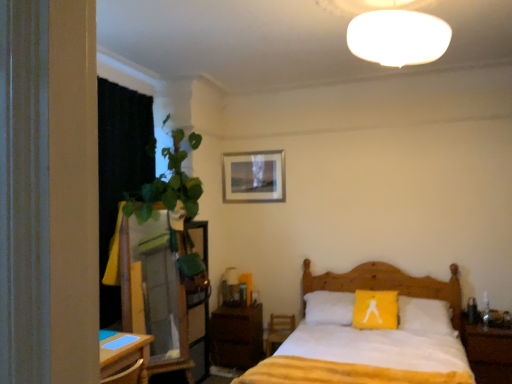
Measure the distance between white soft bedsheet at lower center and camera.

They are 2.55 meters apart.

Find the location of a particular element. The width and height of the screenshot is (512, 384). white soft bedsheet at lower center is located at coordinates (367, 357).

The width and height of the screenshot is (512, 384). In order to click on dark brown wood nightstand at lower center, the 2th nightstand viewed from the front in this screenshot , I will do 236,336.

Find the location of a particular element. The image size is (512, 384). white soft bed at center is located at coordinates (362, 358).

Find the location of a particular element. This screenshot has width=512, height=384. black fabric curtain at left is located at coordinates (120, 169).

Where is `white soft bedsheet at lower center`? white soft bedsheet at lower center is located at coordinates (367, 357).

Can wooden nightstand at right, which appears as the 2th nightstand when viewed from the left, be found inside white soft bed at center?

No, wooden nightstand at right, which appears as the 2th nightstand when viewed from the left, is located outside of white soft bed at center.

Is white soft bed at center aimed at wooden nightstand at right, arranged as the 1th nightstand when viewed from the front?

No, white soft bed at center does not turn towards wooden nightstand at right, arranged as the 1th nightstand when viewed from the front.

Does white soft bed at center have a smaller size compared to wooden nightstand at right, positioned as the 1th nightstand in right-to-left order?

No, white soft bed at center is not smaller than wooden nightstand at right, positioned as the 1th nightstand in right-to-left order.

From the image's perspective, would you say white soft bed at center is positioned over wooden nightstand at right, which appears as the 2th nightstand when viewed from the left?

Correct, white soft bed at center appears higher than wooden nightstand at right, which appears as the 2th nightstand when viewed from the left, in the image.

Is white soft bedsheet at lower center bigger or smaller than matte glass table lamp at center?

In the image, white soft bedsheet at lower center appears to be larger than matte glass table lamp at center.

Is white soft bedsheet at lower center aimed at matte glass table lamp at center?

No, white soft bedsheet at lower center is not oriented towards matte glass table lamp at center.

Is white soft bedsheet at lower center wider or thinner than matte glass table lamp at center?

white soft bedsheet at lower center is wider than matte glass table lamp at center.

From the image's perspective, which object appears higher, white soft bedsheet at lower center or matte glass table lamp at center?

matte glass table lamp at center appears higher in the image.

From a real-world perspective, is matte glass table lamp at center physically located above or below gold-framed picture at upper center?

In terms of real-world spatial position, matte glass table lamp at center is below gold-framed picture at upper center.

Which of these two, matte glass table lamp at center or gold-framed picture at upper center, is bigger?

matte glass table lamp at center is bigger.

Looking at this image, from the image's perspective, is matte glass table lamp at center on top of gold-framed picture at upper center?

No, from the image's perspective, matte glass table lamp at center is not over gold-framed picture at upper center.

Is white soft bedsheet at lower center completely or partially outside of dark brown wood nightstand at lower center, the 2th nightstand viewed from the front?

Yes, white soft bedsheet at lower center is outside of dark brown wood nightstand at lower center, the 2th nightstand viewed from the front.

In the scene shown: From the image's perspective, between white soft bedsheet at lower center and dark brown wood nightstand at lower center, which is the 1th nightstand from back to front, which one is located above?

white soft bedsheet at lower center appears higher in the image.

Considering the sizes of objects white soft bedsheet at lower center and dark brown wood nightstand at lower center, which is counted as the 1th nightstand, starting from the left, in the image provided, who is smaller, white soft bedsheet at lower center or dark brown wood nightstand at lower center, which is counted as the 1th nightstand, starting from the left,?

white soft bedsheet at lower center is smaller.

Are white soft bedsheet at lower center and dark brown wood nightstand at lower center, which is the 1th nightstand from back to front, beside each other?

white soft bedsheet at lower center and dark brown wood nightstand at lower center, which is the 1th nightstand from back to front, are clearly separated.

From the image's perspective, would you say wooden dresser at left is shown under dark brown wood nightstand at lower center, the 2th nightstand from the right?

No, from the image's perspective, wooden dresser at left is not beneath dark brown wood nightstand at lower center, the 2th nightstand from the right.

Considering the positions of point (174, 217) and point (255, 357), is point (174, 217) closer or farther from the camera than point (255, 357)?

Clearly, point (174, 217) is closer to the camera than point (255, 357).

Is wooden dresser at left closer to camera compared to dark brown wood nightstand at lower center, which is the 1th nightstand from back to front?

Yes, wooden dresser at left is closer to the viewer.

In order to click on dresser located on the left of dark brown wood nightstand at lower center, the 2th nightstand from the right in this screenshot , I will do `click(162, 294)`.

How far apart are wooden armchair at lower center and white soft bedsheet at lower center?

They are 4.61 feet apart.

Does wooden armchair at lower center have a greater height compared to white soft bedsheet at lower center?

Indeed, wooden armchair at lower center has a greater height compared to white soft bedsheet at lower center.

Is wooden armchair at lower center beside white soft bedsheet at lower center?

No.

Considering the sizes of wooden armchair at lower center and white soft bedsheet at lower center in the image, is wooden armchair at lower center wider or thinner than white soft bedsheet at lower center?

Considering their sizes, wooden armchair at lower center looks slimmer than white soft bedsheet at lower center.

Find the location of a particular element. The image size is (512, 384). picture frame above the dark brown wood nightstand at lower center, the 2th nightstand from the right (from a real-world perspective) is located at coordinates (254, 177).

Which is in front, point (253, 175) or point (228, 328)?

The point (228, 328) is closer.

From a real-world perspective, which object rests below the other?

dark brown wood nightstand at lower center, which is the 1th nightstand from back to front, is physically lower.

Identify the location of bed above the wooden nightstand at right, the second nightstand in the back-to-front sequence (from a real-world perspective). The height and width of the screenshot is (384, 512). (362, 358).

This screenshot has height=384, width=512. I want to click on sheet below the matte glass table lamp at center (from the image's perspective), so click(x=367, y=357).

From the image, which object appears to be nearer to gold-framed picture at upper center, dark brown wood nightstand at lower center, which is the 1th nightstand from back to front, or matte glass table lamp at center?

matte glass table lamp at center is closer to gold-framed picture at upper center.

When comparing their distances from white soft bedsheet at lower center, does wooden dresser at left or gold-framed picture at upper center seem closer?

The object closer to white soft bedsheet at lower center is wooden dresser at left.

Estimate the real-world distances between objects in this image. Which object is closer to wooden dresser at left, matte glass table lamp at center or dark brown wood nightstand at lower center, the 2th nightstand viewed from the front?

The object closer to wooden dresser at left is dark brown wood nightstand at lower center, the 2th nightstand viewed from the front.

Estimate the real-world distances between objects in this image. Which object is closer to wooden armchair at lower center, gold-framed picture at upper center or dark brown wood nightstand at lower center, which is the 1th nightstand from back to front?

dark brown wood nightstand at lower center, which is the 1th nightstand from back to front, lies closer to wooden armchair at lower center than the other object.

When comparing their distances from wooden armchair at lower center, does wooden nightstand at right, positioned as the 1th nightstand in right-to-left order, or white soft bedsheet at lower center seem further?

Based on the image, wooden nightstand at right, positioned as the 1th nightstand in right-to-left order, appears to be further to wooden armchair at lower center.

Consider the image. Based on their spatial positions, is black fabric curtain at left or gold-framed picture at upper center further from dark brown wood nightstand at lower center, the 2th nightstand from the right?

Based on the image, black fabric curtain at left appears to be further to dark brown wood nightstand at lower center, the 2th nightstand from the right.

Looking at the image, which one is located further to dark brown wood nightstand at lower center, which is the 1th nightstand from back to front, white soft bed at center or wooden armchair at lower center?

Based on the image, white soft bed at center appears to be further to dark brown wood nightstand at lower center, which is the 1th nightstand from back to front.

When comparing their distances from black fabric curtain at left, does white soft bedsheet at lower center or wooden nightstand at right, the second nightstand in the back-to-front sequence, seem further?

Among the two, wooden nightstand at right, the second nightstand in the back-to-front sequence, is located further to black fabric curtain at left.

You are a GUI agent. You are given a task and a screenshot of the screen. Output one action in this format:
    pyautogui.click(x=<x>, y=<y>)
    Task: Click on the picture frame between dark brown wood nightstand at lower center, which is the 1th nightstand from back to front, and wooden nightstand at right, the second nightstand in the back-to-front sequence
    The width and height of the screenshot is (512, 384).
    Given the screenshot: What is the action you would take?
    point(254,177)

Locate an element on the screen. dresser between black fabric curtain at left and wooden armchair at lower center from left to right is located at coordinates (162, 294).

You are a GUI agent. You are given a task and a screenshot of the screen. Output one action in this format:
    pyautogui.click(x=<x>, y=<y>)
    Task: Click on the curtain located between white soft bed at center and gold-framed picture at upper center in the depth direction
    
    Given the screenshot: What is the action you would take?
    pyautogui.click(x=120, y=169)

Find the location of a particular element. The image size is (512, 384). table lamp between gold-framed picture at upper center and dark brown wood nightstand at lower center, which is counted as the 1th nightstand, starting from the left, vertically is located at coordinates (228, 286).